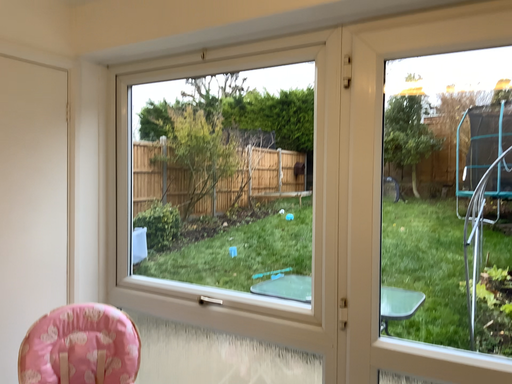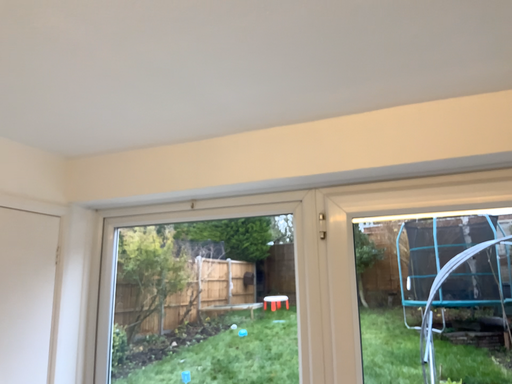
Question: How did the camera likely rotate when shooting the video?

Choices:
 (A) rotated downward
 (B) rotated upward

Answer: (B)